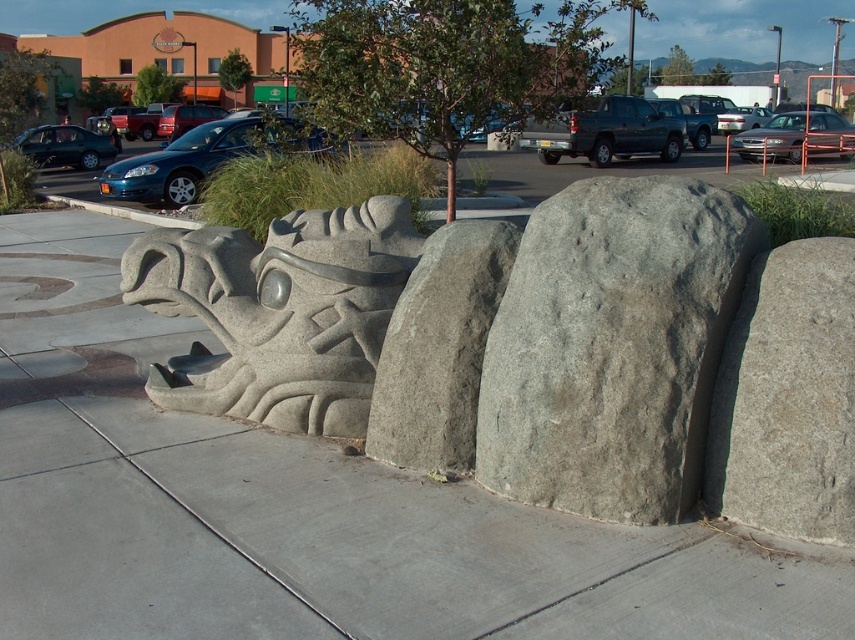
You are standing at the point marked as point (788, 397) in the image. What is the material of the surface you are currently standing on?

The point (788, 397) is on gray stone boulder at center right, so the surface is gray stone.